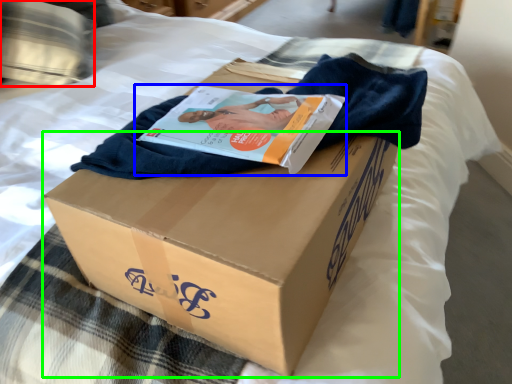
Question: Based on their relative distances, which object is farther from pillow (highlighted by a red box)? Choose from magazine (highlighted by a blue box) and cardboard box (highlighted by a green box).

Choices:
 (A) magazine
 (B) cardboard box

Answer: (B)